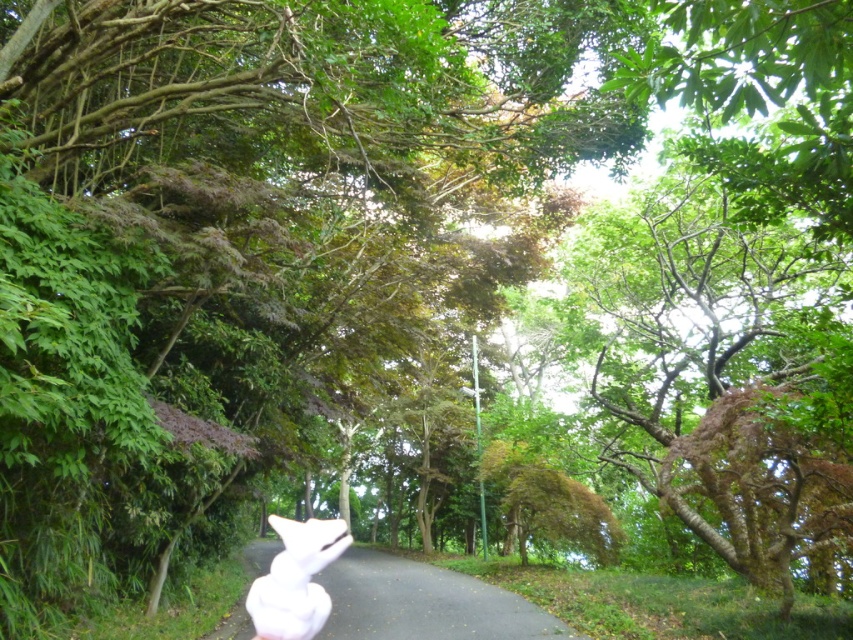
Question: Does white fabric at center have a smaller size compared to white fluffy bunny at center?

Choices:
 (A) yes
 (B) no

Answer: (A)

Question: Is white fabric at center to the left of white fluffy bunny at center from the viewer's perspective?

Choices:
 (A) yes
 (B) no

Answer: (B)

Question: Which point is farther to the camera?

Choices:
 (A) (335, 541)
 (B) (393, 630)

Answer: (B)

Question: Does white fabric at center appear over white fluffy bunny at center?

Choices:
 (A) no
 (B) yes

Answer: (B)

Question: Which point is farther to the camera?

Choices:
 (A) white fabric at center
 (B) white fluffy bunny at center

Answer: (A)